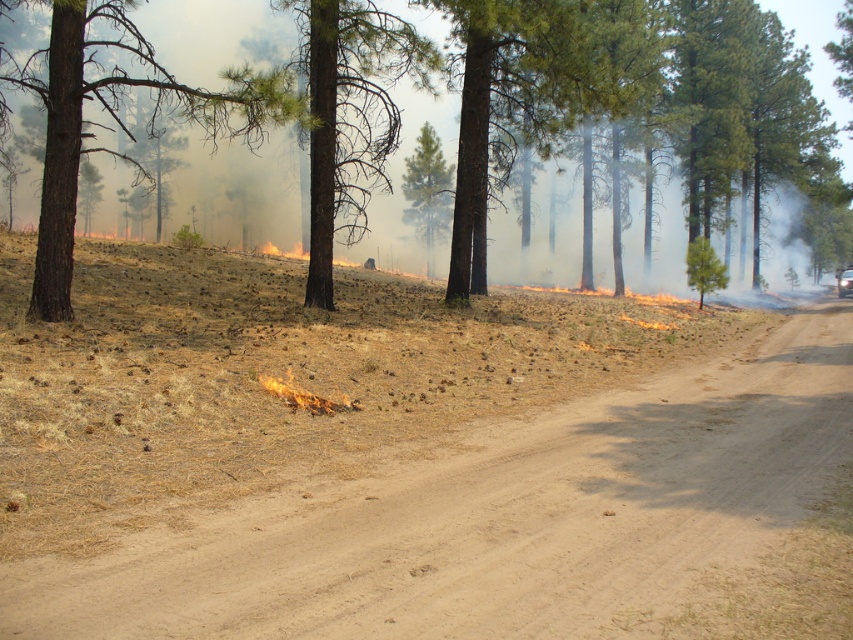
You are a firefighter trying to navigate through the forest during a controlled burn. You need to reach a specific point marked at coordinates point (x=67, y=266). Given that the distance between you and this point is 12.56 meters, and considering the dry, smoky conditions, can you safely walk this distance without getting too close to the flames?

The distance between you and the point (x=67, y=266) is 12.56 meters. Since the path is through a dry, smoky forest with visible flames from the controlled burn, you must assess the fire intensity and ensure the route is clear of active flames before proceeding. If the area is safe, the distance is manageable, but caution is advised due to the environmental conditions.

You are a firefighter assessing the wildfire scene. You notice a brown rough bark tree at left. Based on its position, is it closer to the edge of the road or the center of the road?

The brown rough bark tree at left is located at point (115, 120), which places it closer to the edge of the road rather than the center.

You are a firefighter assessing the fire zone. You see a green textured pine tree at center and a green rough bark tree at center. Which tree has a larger width?

The green textured pine tree at center has a larger width than the green rough bark tree at center.